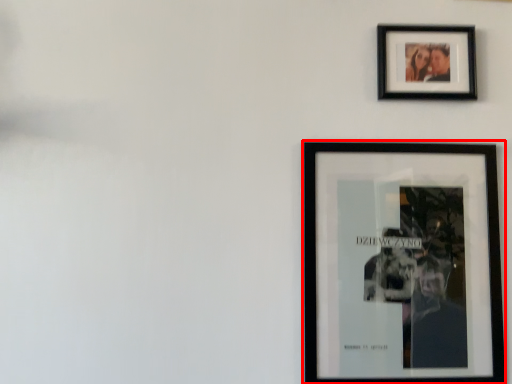
Question: Considering the relative positions of picture frame (annotated by the red box) and picture frame in the image provided, where is picture frame (annotated by the red box) located with respect to the staircase?

Choices:
 (A) right
 (B) left

Answer: (B)